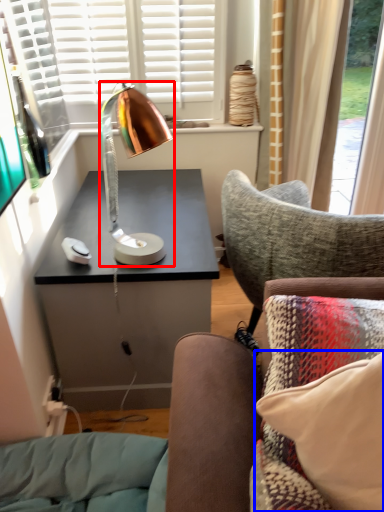
Question: Among these objects, which one is nearest to the camera, lamp (highlighted by a red box) or pillow (highlighted by a blue box)?

Choices:
 (A) lamp
 (B) pillow

Answer: (B)